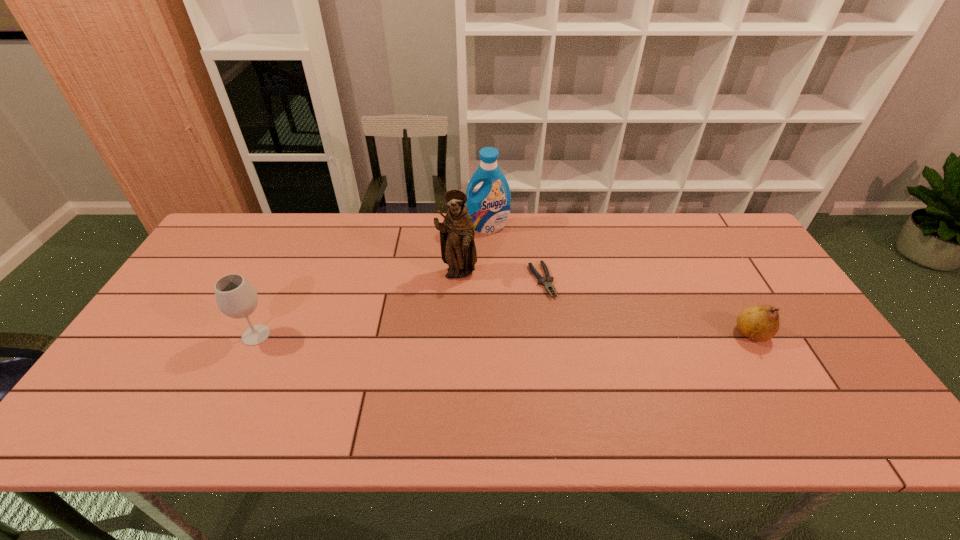
Where is `object that is at the right edge`? object that is at the right edge is located at coordinates (760, 323).

In the image, there is a desktop. Identify the location of vacant space at the far edge. This screenshot has width=960, height=540. click(361, 240).

Where is `free space at the near edge`? free space at the near edge is located at coordinates (338, 388).

The height and width of the screenshot is (540, 960). I want to click on free space at the right edge, so click(x=759, y=342).

Where is `vacant space at the far right corner of the desktop`? vacant space at the far right corner of the desktop is located at coordinates (x=749, y=246).

Where is `empty space that is in between the figurine and the shortest object`? empty space that is in between the figurine and the shortest object is located at coordinates (499, 278).

The image size is (960, 540). In order to click on empty location between the detergent and the pear in this screenshot , I will do `click(620, 280)`.

At what (x,y) coordinates should I click in order to perform the action: click on unoccupied area between the pear and the third tallest object. Please return your answer as a coordinate pair (x, y). Looking at the image, I should click on (504, 334).

Find the location of a particular element. vacant space that's between the fourth object from left to right and the figurine is located at coordinates (499, 278).

Identify the location of vacant space in between the farthest object and the wineglass. (372, 281).